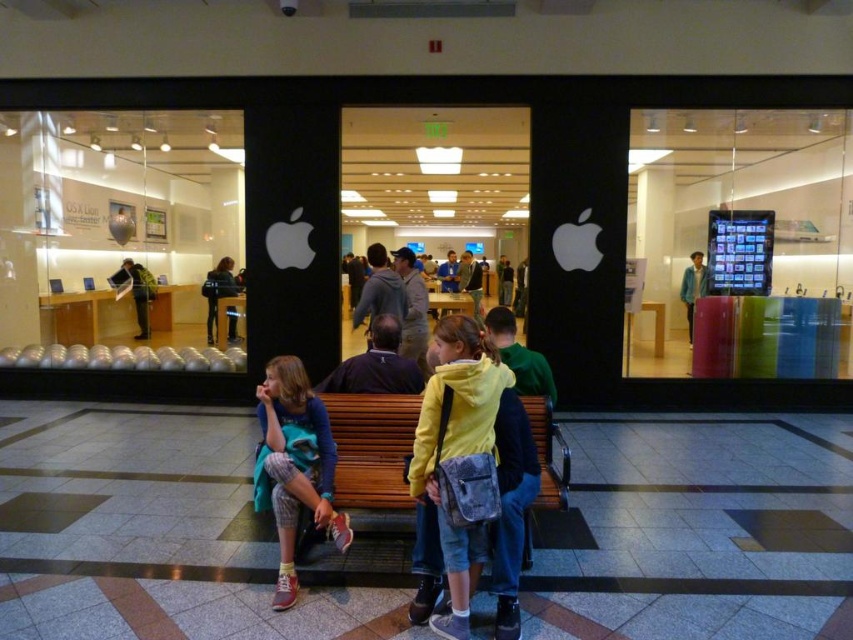
You are a store manager who wants to ensure that the two customers wearing the yellow matte jacket at center and the dark blue hoodie at center can both enter the store through the entrance. The entrance has a width of 1 meter. Can both customers pass through the entrance simultaneously without touching each other?

The yellow matte jacket at center is thinner than the dark blue hoodie at center. Since the entrance is 1 meter wide, both customers can likely pass through simultaneously as their combined width is likely less than 1 meter, assuming they walk side by side.

You are a photographer trying to capture both the yellow matte jacket at center and the dark blue hoodie at center in a single shot. Since you want to ensure both are clearly visible, which clothing item should you focus on first to account for their sizes?

The yellow matte jacket at center is larger in size than the dark blue hoodie at center, so you should focus on the yellow matte jacket at center first to ensure its details are sharp, as it occupies more space in the frame.

You are planning to sit on the brown wooden bench at center with your friend wearing a dark blue hoodie at center. Considering the bench and hoodie sizes, will there be enough space for both of you to sit comfortably?

The brown wooden bench at center is wider than the dark blue hoodie at center, so there should be enough space for both of you to sit comfortably.